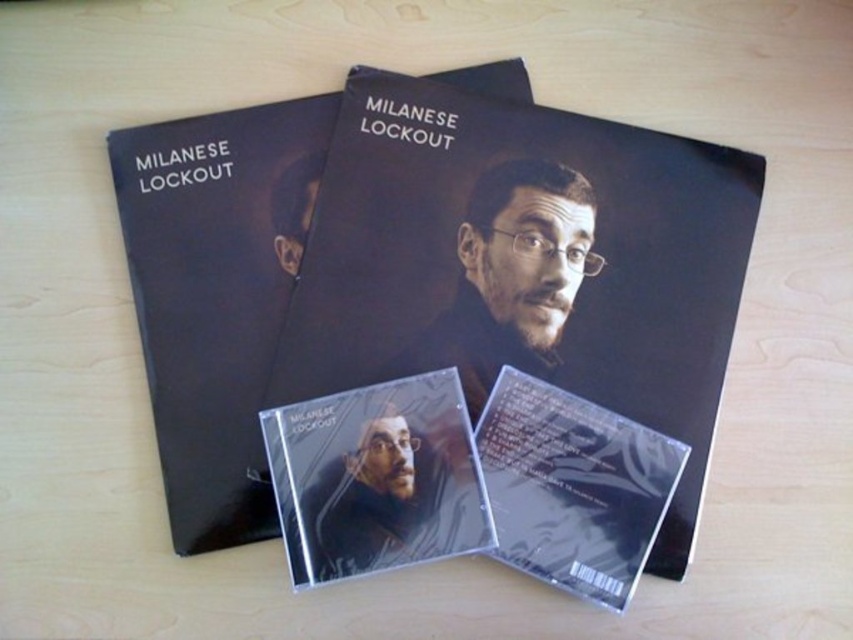
Question: Can you confirm if black matte album at center is positioned below transparent plastic cd at center?

Choices:
 (A) no
 (B) yes

Answer: (A)

Question: Which object is positioned closest to the matte black album at center?

Choices:
 (A) transparent plastic cd at center
 (B) black matte album at center
 (C) transparent plastic cd case at center

Answer: (A)

Question: Can you confirm if matte black album at center is positioned to the left of transparent plastic cd at center?

Choices:
 (A) no
 (B) yes

Answer: (B)

Question: Among these points, which one is nearest to the camera?

Choices:
 (A) (433, 161)
 (B) (601, 476)
 (C) (245, 449)

Answer: (B)

Question: Which point appears farthest from the camera in this image?

Choices:
 (A) (660, 509)
 (B) (154, 188)
 (C) (281, 432)

Answer: (B)

Question: Does matte black album at center lie behind transparent plastic cd case at center?

Choices:
 (A) no
 (B) yes

Answer: (B)